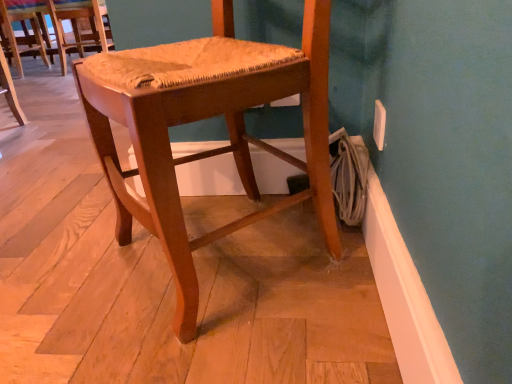
Where is `vacant space underneath wooden woven seat at center, marked as the second chair in a top-to-bottom arrangement (from a real-world perspective)`? The height and width of the screenshot is (384, 512). vacant space underneath wooden woven seat at center, marked as the second chair in a top-to-bottom arrangement (from a real-world perspective) is located at coordinates (234, 260).